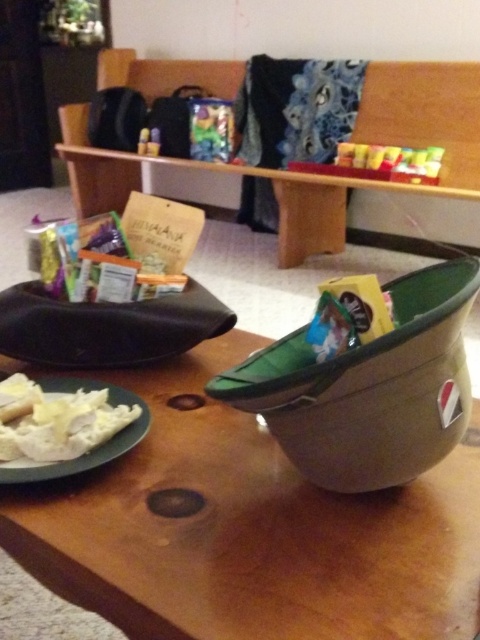
Question: Does wooden table at center appear on the right side of white matte plate at lower left?

Choices:
 (A) yes
 (B) no

Answer: (A)

Question: Which object is farther from the camera taking this photo?

Choices:
 (A) wooden table at center
 (B) matte black camera at upper center

Answer: (B)

Question: Which object appears farthest from the camera in this image?

Choices:
 (A) matte plastic bag at upper center
 (B) white matte plate at lower left
 (C) translucent plastic toy at center
 (D) wooden table at center

Answer: (A)

Question: Is translucent plastic toy at center wider than matte black camera at upper center?

Choices:
 (A) no
 (B) yes

Answer: (B)

Question: Is the position of wooden table at center more distant than that of black fabric tray at left?

Choices:
 (A) no
 (B) yes

Answer: (A)

Question: Which point appears farthest from the camera in this image?

Choices:
 (A) (108, 458)
 (B) (229, 112)
 (C) (152, 148)

Answer: (C)